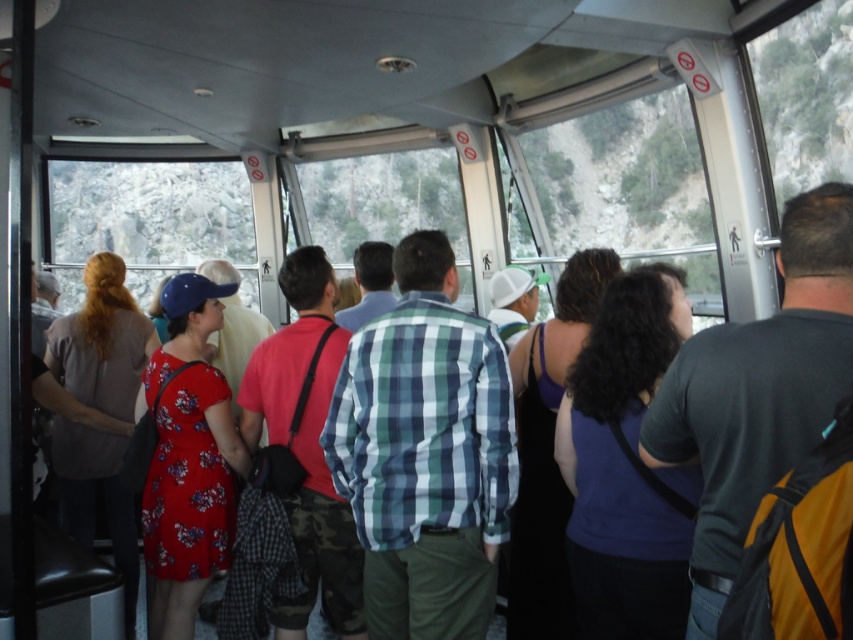
You are a passenger in the cable car and want to reach the floral dress at left to ask a question. Is the dark gray backpack at center blocking your path?

The dark gray backpack at center is positioned over floral dress at left, so it is blocking the path to the floral dress at left.

You are a passenger in the cable car and want to store your belongings. Which object, the dark gray backpack at center or the floral dress at left, has more space available for placing items?

The dark gray backpack at center is smaller than the floral dress at left, so the floral dress at left has more space available for placing items.